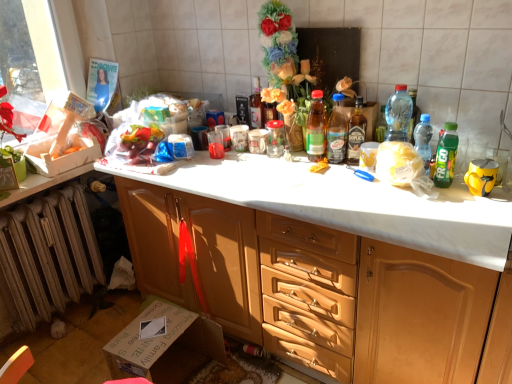
This screenshot has height=384, width=512. I want to click on translucent plastic bottle at center, which is the 5th bottle from right to left, so click(x=337, y=131).

The height and width of the screenshot is (384, 512). Find the location of `transparent plastic bottle at right, which is counted as the fifth bottle, starting from the left`. transparent plastic bottle at right, which is counted as the fifth bottle, starting from the left is located at coordinates (398, 114).

The image size is (512, 384). Identify the location of translucent plastic bottle at center, acting as the second bottle starting from the left. (316, 128).

The width and height of the screenshot is (512, 384). What do you see at coordinates (316, 128) in the screenshot? I see `translucent plastic bottle at center, acting as the second bottle starting from the left` at bounding box center [316, 128].

Find the location of a particular element. The image size is (512, 384). transparent glass jar at center is located at coordinates (275, 138).

The height and width of the screenshot is (384, 512). What do you see at coordinates (48, 255) in the screenshot?
I see `rusty metal radiator at lower left` at bounding box center [48, 255].

Identify the location of translucent glass bottle at center, which is counted as the fourth bottle, starting from the right. This screenshot has height=384, width=512. (356, 132).

This screenshot has height=384, width=512. Describe the element at coordinates (446, 155) in the screenshot. I see `green plastic bottle at right, which ranks as the 1th bottle in right-to-left order` at that location.

You are a GUI agent. You are given a task and a screenshot of the screen. Output one action in this format:
    pyautogui.click(x=<x>, y=<y>)
    Task: Click on the translucent plastic bottle at center, positioned as the third bottle in left-to-right order
    This screenshot has width=512, height=384.
    Given the screenshot: What is the action you would take?
    [337, 131]

Who is bigger, translucent plastic bottle at center, acting as the second bottle starting from the left, or transparent plastic bottle at right, the 3th bottle in the right-to-left sequence?

Bigger between the two is transparent plastic bottle at right, the 3th bottle in the right-to-left sequence.

How different are the orientations of translucent plastic bottle at center, acting as the second bottle starting from the left, and transparent plastic bottle at right, the 3th bottle in the right-to-left sequence, in degrees?

0.00208 degrees separate the facing orientations of translucent plastic bottle at center, acting as the second bottle starting from the left, and transparent plastic bottle at right, the 3th bottle in the right-to-left sequence.

Would you say translucent plastic bottle at center, the 6th bottle when ordered from right to left, is to the left or to the right of transparent plastic bottle at right, the 3th bottle in the right-to-left sequence, in the picture?

Clearly, translucent plastic bottle at center, the 6th bottle when ordered from right to left, is on the left of transparent plastic bottle at right, the 3th bottle in the right-to-left sequence, in the image.

Between point (316, 131) and point (389, 117), which one is positioned in front?

The point (389, 117) is closer to the camera.

From the picture: From a real-world perspective, is transparent glass jar at center beneath translucent glass bottle at center, which is counted as the fourth bottle, starting from the left?

Correct, in the physical world, transparent glass jar at center is lower than translucent glass bottle at center, which is counted as the fourth bottle, starting from the left.

Is point (283, 134) less distant than point (353, 137)?

No.

Is transparent glass jar at center in front of or behind translucent glass bottle at center, which is counted as the fourth bottle, starting from the left, in the image?

Clearly, transparent glass jar at center is behind translucent glass bottle at center, which is counted as the fourth bottle, starting from the left.

I want to click on bottle that is the 1st object above the translucent plastic bottle at upper right, which is counted as the second bottle, starting from the right (from a real-world perspective), so coord(337,131).

Is translucent plastic bottle at upper right, which is counted as the second bottle, starting from the right, in contact with translucent plastic bottle at center, which is the 5th bottle from right to left?

No, translucent plastic bottle at upper right, which is counted as the second bottle, starting from the right, is not touching translucent plastic bottle at center, which is the 5th bottle from right to left.

Is point (420, 146) closer or farther from the camera than point (343, 157)?

Point (420, 146) is positioned closer to the camera compared to point (343, 157).

Considering the relative positions of rusty metal radiator at lower left and translucent plastic bottle at center, the 6th bottle when ordered from right to left, in the image provided, is rusty metal radiator at lower left to the left of translucent plastic bottle at center, the 6th bottle when ordered from right to left, from the viewer's perspective?

Yes, rusty metal radiator at lower left is to the left of translucent plastic bottle at center, the 6th bottle when ordered from right to left.

Is point (79, 247) positioned before point (323, 130)?

No, (79, 247) is behind (323, 130).

Would you say translucent plastic bottle at center, the 6th bottle when ordered from right to left, is part of rusty metal radiator at lower left's contents?

Definitely not — translucent plastic bottle at center, the 6th bottle when ordered from right to left, is not inside rusty metal radiator at lower left.

From a real-world perspective, which is physically above, translucent plastic bottle at center, the 6th bottle when ordered from right to left, or translucent plastic bottle at center, which is the 5th bottle from right to left?

In real-world perspective, translucent plastic bottle at center, the 6th bottle when ordered from right to left, is above.

Is translucent plastic bottle at center, the 6th bottle when ordered from right to left, shorter than translucent plastic bottle at center, positioned as the third bottle in left-to-right order?

Yes.

Which bottle is the 1st one when counting from the front of the translucent plastic bottle at center, the 6th bottle when ordered from right to left? Please provide its 2D coordinates.

[(337, 131)]

From the image's perspective, is translucent glass bottle at center, the 1th bottle when ordered from left to right, under translucent plastic bottle at center, positioned as the third bottle in left-to-right order?

No, from the image's perspective, translucent glass bottle at center, the 1th bottle when ordered from left to right, is not beneath translucent plastic bottle at center, positioned as the third bottle in left-to-right order.

Looking at this image, would you say translucent glass bottle at center, the 1th bottle when ordered from left to right, is outside translucent plastic bottle at center, which is the 5th bottle from right to left?

Indeed, translucent glass bottle at center, the 1th bottle when ordered from left to right, is completely outside translucent plastic bottle at center, which is the 5th bottle from right to left.

Starting from the translucent glass bottle at center, acting as the 7th bottle starting from the right, which bottle is the 2nd one to the right? Please provide its 2D coordinates.

[(337, 131)]

Which object is positioned more to the left, translucent glass bottle at center, the 1th bottle when ordered from left to right, or translucent plastic bottle at center, positioned as the third bottle in left-to-right order?

Positioned to the left is translucent glass bottle at center, the 1th bottle when ordered from left to right.

Is point (38, 305) closer or farther from the camera than point (451, 124)?

Point (38, 305) is positioned farther from the camera compared to point (451, 124).

Can you tell me how much rusty metal radiator at lower left and green plastic bottle at right, which ranks as the 7th bottle in left-to-right order, differ in facing direction?

The facing directions of rusty metal radiator at lower left and green plastic bottle at right, which ranks as the 7th bottle in left-to-right order, are 91.3 degrees apart.

From the image's perspective, is rusty metal radiator at lower left positioned above or below green plastic bottle at right, which ranks as the 1th bottle in right-to-left order?

rusty metal radiator at lower left is below green plastic bottle at right, which ranks as the 1th bottle in right-to-left order.

From the picture: Is rusty metal radiator at lower left aimed at green plastic bottle at right, which ranks as the 1th bottle in right-to-left order?

Yes, rusty metal radiator at lower left is facing green plastic bottle at right, which ranks as the 1th bottle in right-to-left order.

Locate an element on the screen. This screenshot has height=384, width=512. the 3rd bottle to the right when counting from the translucent plastic bottle at center, acting as the second bottle starting from the left is located at coordinates (398, 114).

Find the location of a particular element. Image resolution: width=512 pixels, height=384 pixels. glass jar on the left of translucent glass bottle at center, which is counted as the fourth bottle, starting from the left is located at coordinates point(275,138).

Looking at this image, which object lies further to the anchor point translucent glass bottle at center, acting as the 7th bottle starting from the right, green plastic bottle at right, which ranks as the 1th bottle in right-to-left order, or translucent plastic bottle at center, positioned as the third bottle in left-to-right order?

Among the two, green plastic bottle at right, which ranks as the 1th bottle in right-to-left order, is located further to translucent glass bottle at center, acting as the 7th bottle starting from the right.

Which object lies nearer to the anchor point translucent plastic bottle at center, which is the 5th bottle from right to left, translucent glass bottle at center, acting as the 7th bottle starting from the right, or green plastic bottle at right, which ranks as the 7th bottle in left-to-right order?

Among the two, green plastic bottle at right, which ranks as the 7th bottle in left-to-right order, is located nearer to translucent plastic bottle at center, which is the 5th bottle from right to left.

Looking at the image, which one is located closer to translucent glass bottle at center, which is counted as the fourth bottle, starting from the right, translucent plastic bottle at upper right, which is counted as the second bottle, starting from the right, or wooden cabinet at center?

translucent plastic bottle at upper right, which is counted as the second bottle, starting from the right, lies closer to translucent glass bottle at center, which is counted as the fourth bottle, starting from the right, than the other object.

Estimate the real-world distances between objects in this image. Which object is closer to transparent glass jar at center, transparent plastic bottle at right, which is counted as the fifth bottle, starting from the left, or wooden cabinet at center?

Among the two, transparent plastic bottle at right, which is counted as the fifth bottle, starting from the left, is located nearer to transparent glass jar at center.

Estimate the real-world distances between objects in this image. Which object is further from translucent plastic bottle at center, which is the 5th bottle from right to left, wooden cabinet at center or transparent glass jar at center?

Among the two, wooden cabinet at center is located further to translucent plastic bottle at center, which is the 5th bottle from right to left.

Looking at the image, which one is located closer to transparent glass jar at center, translucent glass bottle at center, which is counted as the fourth bottle, starting from the left, or transparent plastic bottle at right, the 3th bottle in the right-to-left sequence?

translucent glass bottle at center, which is counted as the fourth bottle, starting from the left, is positioned closer to the anchor transparent glass jar at center.

Considering their positions, is translucent glass bottle at center, the 1th bottle when ordered from left to right, positioned closer to translucent plastic bottle at center, acting as the second bottle starting from the left, than rusty metal radiator at lower left?

translucent glass bottle at center, the 1th bottle when ordered from left to right, lies closer to translucent plastic bottle at center, acting as the second bottle starting from the left, than the other object.

Which object lies further to the anchor point transparent plastic bottle at right, the 3th bottle in the right-to-left sequence, translucent plastic bottle at upper right, which is counted as the second bottle, starting from the right, or green plastic bottle at right, which ranks as the 7th bottle in left-to-right order?

The object further to transparent plastic bottle at right, the 3th bottle in the right-to-left sequence, is green plastic bottle at right, which ranks as the 7th bottle in left-to-right order.

This screenshot has height=384, width=512. In order to click on glass jar situated between translucent glass bottle at center, the 1th bottle when ordered from left to right, and transparent plastic bottle at right, the 3th bottle in the right-to-left sequence, from left to right in this screenshot , I will do `click(275, 138)`.

The image size is (512, 384). In order to click on glass jar located between rusty metal radiator at lower left and translucent glass bottle at center, which is counted as the fourth bottle, starting from the left, in the left-right direction in this screenshot , I will do `click(275, 138)`.

Identify the location of glass jar situated between translucent glass bottle at center, acting as the 7th bottle starting from the right, and green plastic bottle at right, which ranks as the 1th bottle in right-to-left order, from left to right. (275, 138).

Find the location of a particular element. bottle between translucent plastic bottle at center, which is the 5th bottle from right to left, and transparent plastic bottle at right, which is counted as the fifth bottle, starting from the left, in the horizontal direction is located at coordinates pyautogui.click(x=356, y=132).